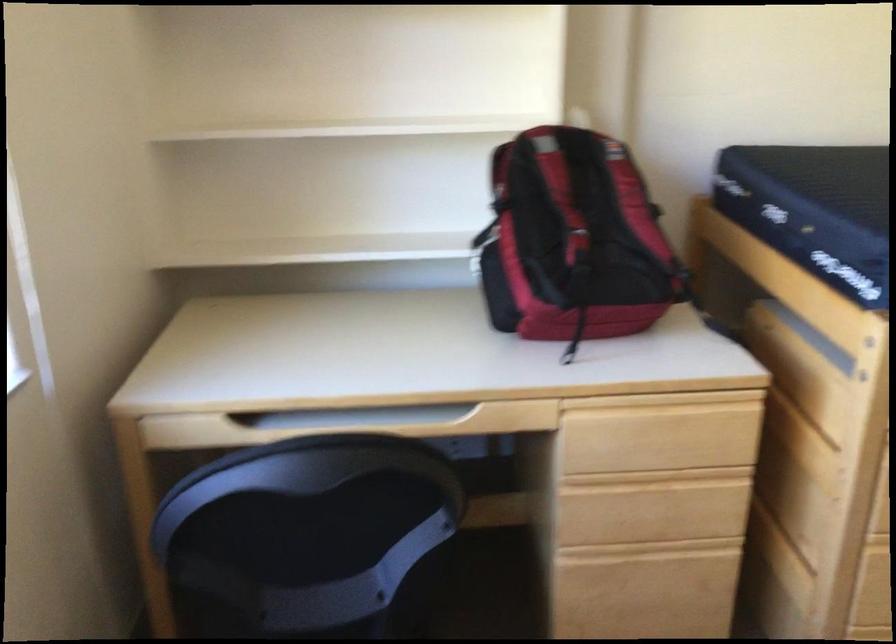
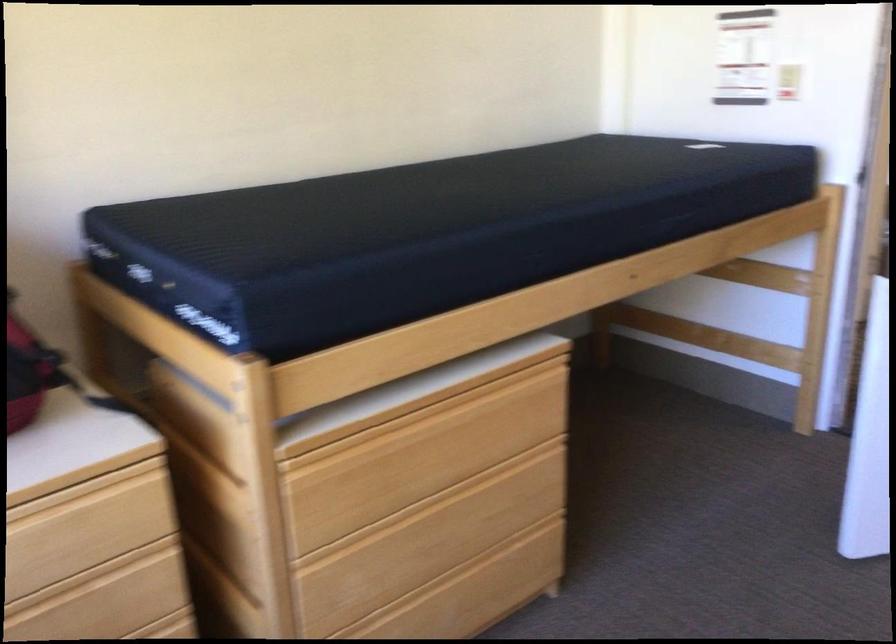
Question: The images are taken continuously from a first-person perspective. In which direction is your viewpoint rotating?

Choices:
 (A) Left
 (B) Right
 (C) Up
 (D) Down

Answer: (B)